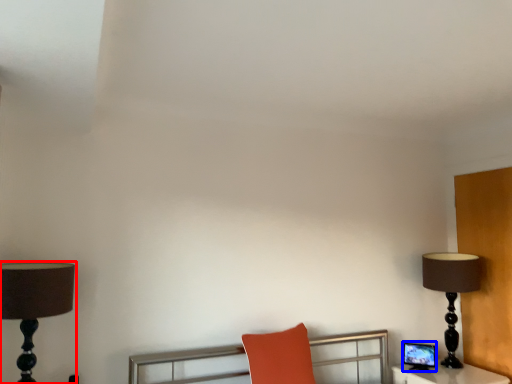
Question: Which of the following is the closest to the observer, lamp (highlighted by a red box) or computer monitor (highlighted by a blue box)?

Choices:
 (A) lamp
 (B) computer monitor

Answer: (A)